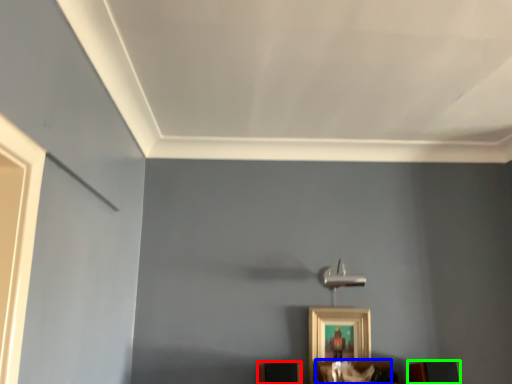
Question: Which is farther away from furniture (highlighted by a red box)? furniture (highlighted by a blue box) or furniture (highlighted by a green box)?

Choices:
 (A) furniture
 (B) furniture

Answer: (B)